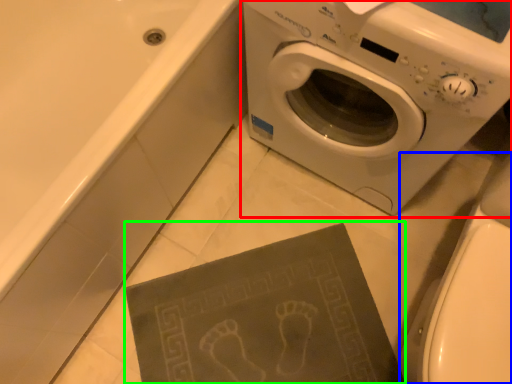
Question: Which object is positioned closest to washing machine (highlighted by a red box)? Select from toilet bowl (highlighted by a blue box) and paperback book (highlighted by a green box).

Choices:
 (A) toilet bowl
 (B) paperback book

Answer: (A)